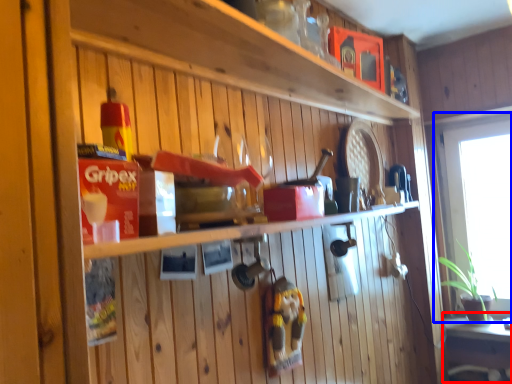
Question: Which point is further to the camera, table (highlighted by a red box) or window (highlighted by a blue box)?

Choices:
 (A) table
 (B) window

Answer: (B)